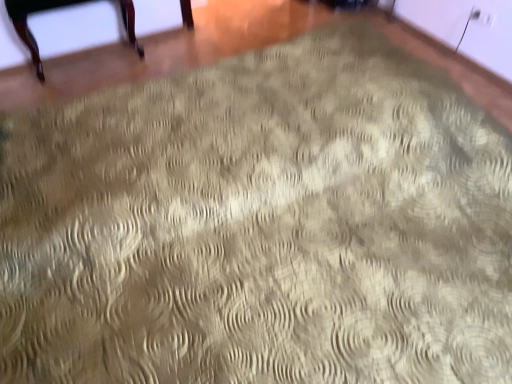
Question: Should I look upward or downward to see mahogany wood chair legs at upper left?

Choices:
 (A) down
 (B) up

Answer: (B)